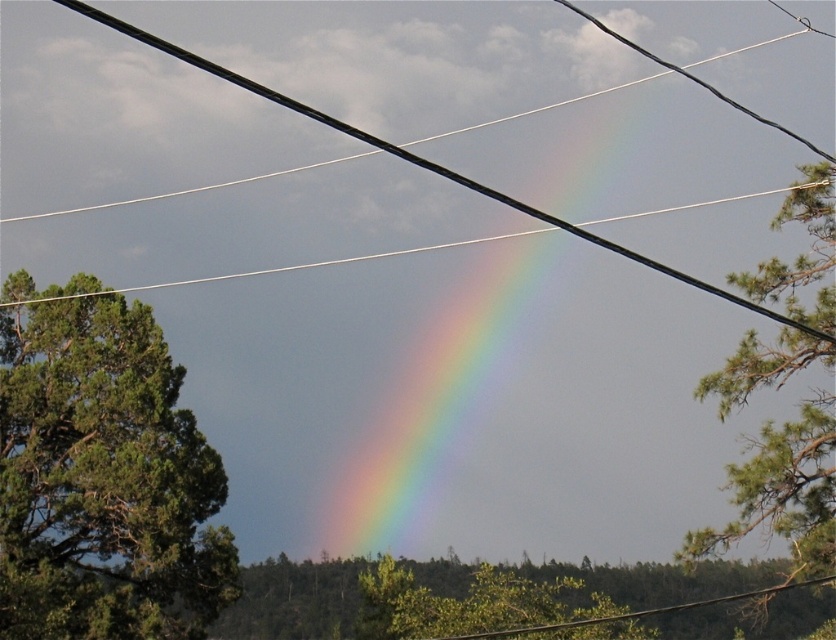
Question: Which of the following is the farthest from the observer?

Choices:
 (A) black wire at center
 (B) green leafy tree at right
 (C) rainbow at center
 (D) green leafy tree at left

Answer: (D)

Question: Which object is closer to the camera taking this photo?

Choices:
 (A) green leafy tree at lower center
 (B) green leafy tree at left
 (C) rainbow at center

Answer: (C)

Question: Among these objects, which one is farthest from the camera?

Choices:
 (A) green leafy tree at right
 (B) green leafy tree at lower center
 (C) rainbow at center
 (D) black wire at center

Answer: (B)

Question: From the image, what is the correct spatial relationship of rainbow at center in relation to green leafy tree at right?

Choices:
 (A) below
 (B) above

Answer: (B)

Question: Can you confirm if rainbow at center is positioned above green leafy tree at lower center?

Choices:
 (A) yes
 (B) no

Answer: (A)

Question: Can you confirm if green leafy tree at lower center is wider than black wire at center?

Choices:
 (A) no
 (B) yes

Answer: (A)